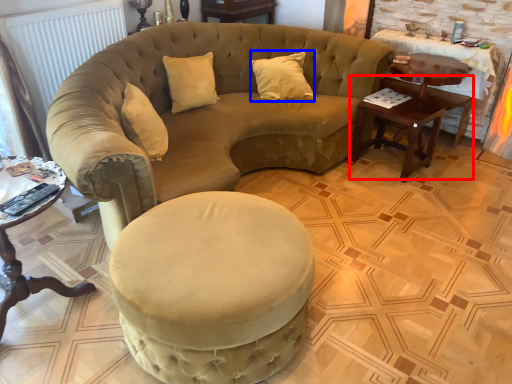
Question: Which of the following is the farthest to the observer, table (highlighted by a red box) or pillow (highlighted by a blue box)?

Choices:
 (A) table
 (B) pillow

Answer: (B)